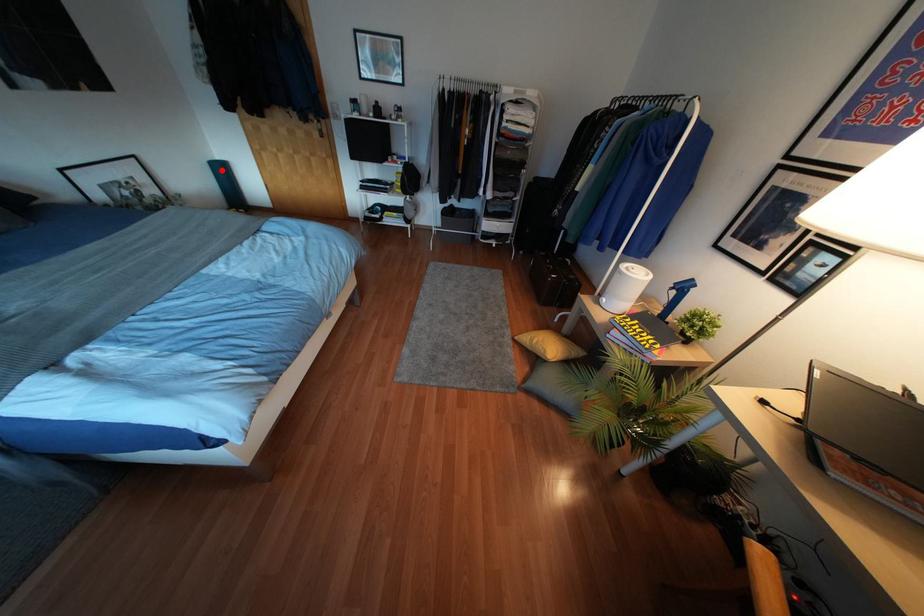
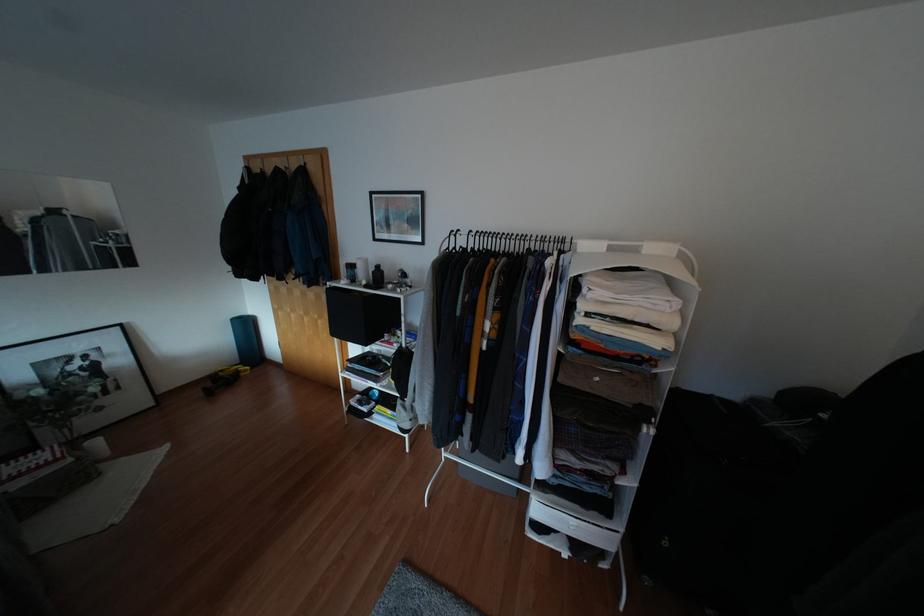
Question: I am providing you with two images of the same scene from different viewpoints. Given a red point in image1, look at the same physical point in image2. Is it:

Choices:
 (A) Closer to the viewpoint
 (B) Farther from the viewpoint

Answer: (B)